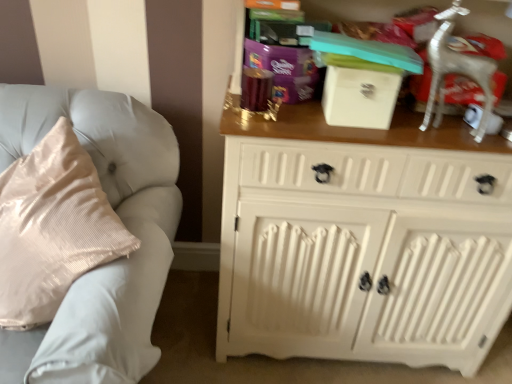
Question: Is white painted wood cabinet at right shorter than silver metallic deer at upper right?

Choices:
 (A) no
 (B) yes

Answer: (A)

Question: Can you confirm if white painted wood cabinet at right is bigger than silver metallic deer at upper right?

Choices:
 (A) yes
 (B) no

Answer: (A)

Question: From the image's perspective, does white painted wood cabinet at right appear higher than silver metallic deer at upper right?

Choices:
 (A) no
 (B) yes

Answer: (A)

Question: Does white painted wood cabinet at right turn towards silver metallic deer at upper right?

Choices:
 (A) yes
 (B) no

Answer: (A)

Question: Does white painted wood cabinet at right touch silver metallic deer at upper right?

Choices:
 (A) no
 (B) yes

Answer: (A)

Question: Considering the positions of silver metallic deer at upper right and white matte box at upper center in the image, is silver metallic deer at upper right wider or thinner than white matte box at upper center?

Choices:
 (A) wide
 (B) thin

Answer: (A)

Question: Relative to white matte box at upper center, is silver metallic deer at upper right in front or behind?

Choices:
 (A) front
 (B) behind

Answer: (A)

Question: Would you say silver metallic deer at upper right is inside or outside white matte box at upper center?

Choices:
 (A) outside
 (B) inside

Answer: (A)

Question: Looking at the image, does silver metallic deer at upper right seem bigger or smaller compared to white matte box at upper center?

Choices:
 (A) big
 (B) small

Answer: (A)

Question: From a real-world perspective, is white painted wood cabinet at right physically located above or below light gray fabric couch at left?

Choices:
 (A) below
 (B) above

Answer: (B)

Question: Considering the positions of white painted wood cabinet at right and light gray fabric couch at left in the image, is white painted wood cabinet at right taller or shorter than light gray fabric couch at left?

Choices:
 (A) short
 (B) tall

Answer: (B)

Question: Visually, is white painted wood cabinet at right positioned to the left or to the right of light gray fabric couch at left?

Choices:
 (A) left
 (B) right

Answer: (B)

Question: In terms of size, does white painted wood cabinet at right appear bigger or smaller than light gray fabric couch at left?

Choices:
 (A) small
 (B) big

Answer: (B)

Question: From a real-world perspective, is purple glossy gift at upper center positioned above or below white painted wood cabinet at right?

Choices:
 (A) above
 (B) below

Answer: (A)

Question: From the image's perspective, is purple glossy gift at upper center positioned above or below white painted wood cabinet at right?

Choices:
 (A) below
 (B) above

Answer: (B)